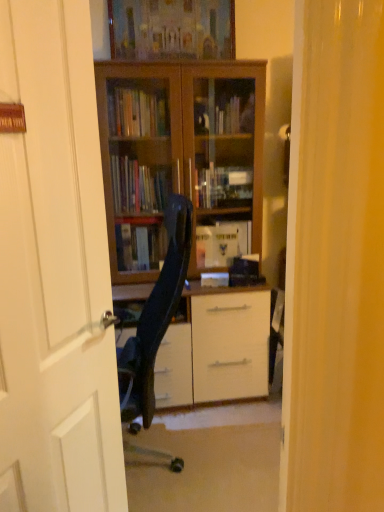
Question: Based on their sizes in the image, would you say wooden bookcase at center is bigger or smaller than wooden picture frame at upper center?

Choices:
 (A) small
 (B) big

Answer: (B)

Question: Is wooden bookcase at center in front of or behind wooden picture frame at upper center in the image?

Choices:
 (A) behind
 (B) front

Answer: (B)

Question: Based on their relative distances, which object is farther from the white wooden door at center?

Choices:
 (A) wooden picture frame at upper center
 (B) black leather chair at center
 (C) wooden bookcase at center

Answer: (A)

Question: Considering the real-world distances, which object is closest to the wooden picture frame at upper center?

Choices:
 (A) white wooden door at center
 (B) wooden bookcase at center
 (C) black leather chair at center

Answer: (B)